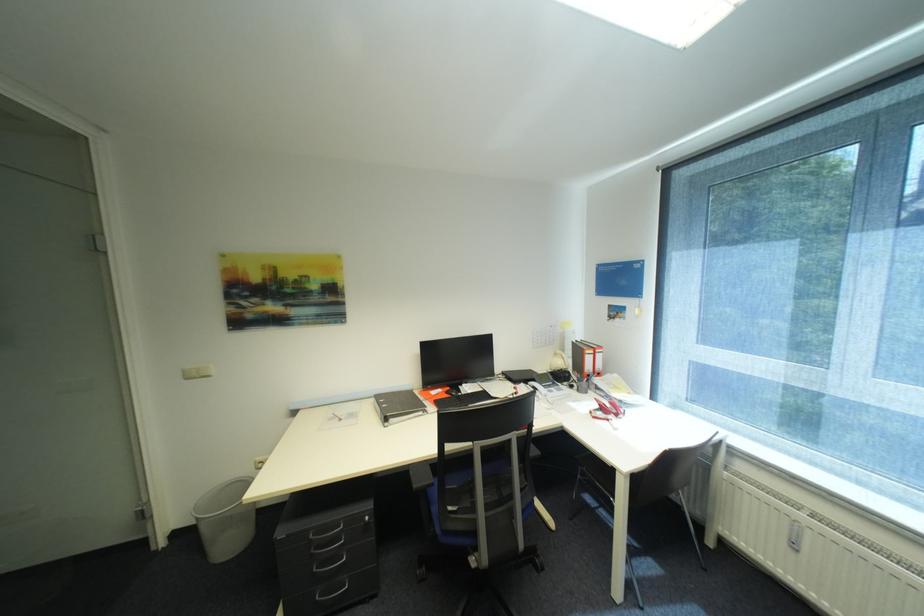
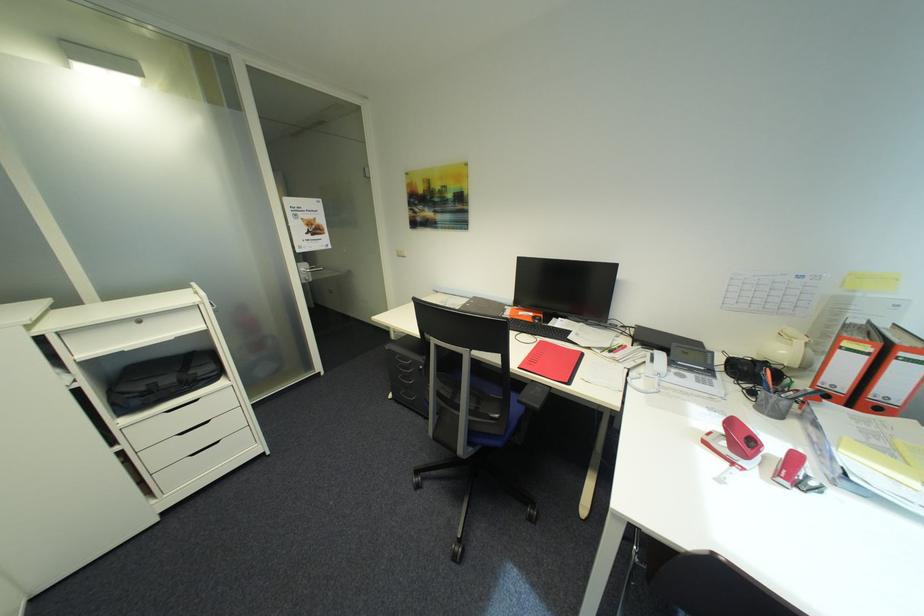
The point at [615,419] is marked in the first image. Where is the corresponding point in the second image?

(742, 464)